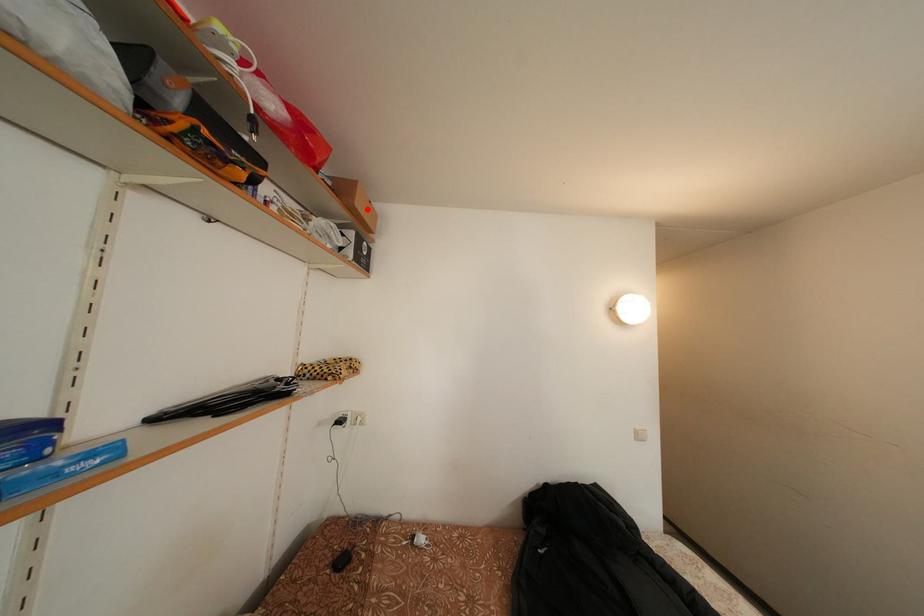
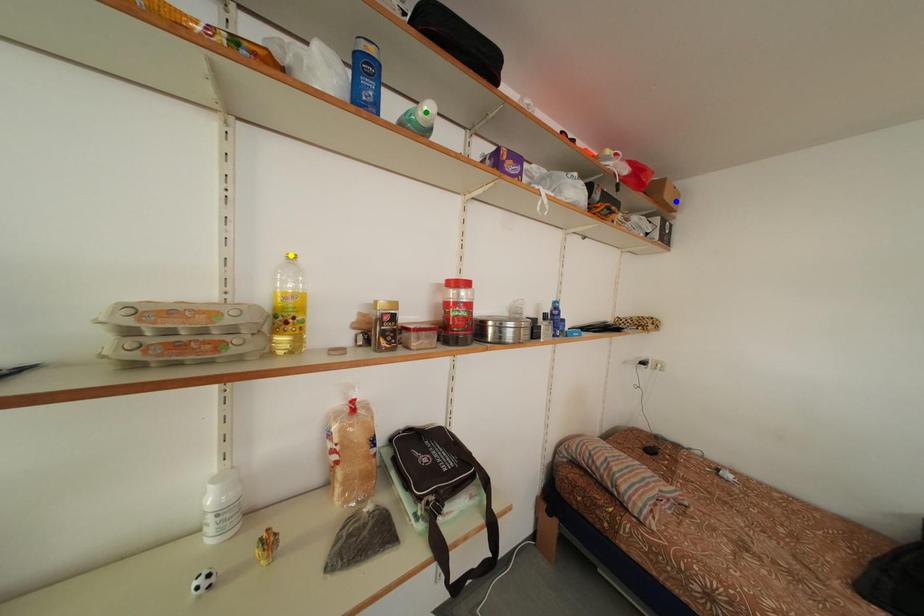
Question: I am providing you with two images of the same scene from different viewpoints. A red point is marked on the first image. You are given multiple points on the second image. In image 2, which mark is for the same physical point as the one in image 1?

Choices:
 (A) yellow point
 (B) blue point
 (C) green point

Answer: (B)